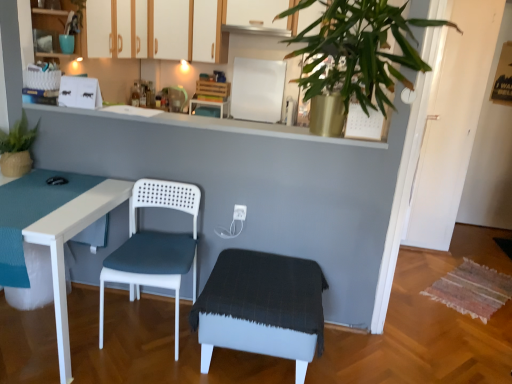
Find the location of `free area in between white plastic chair at center and white fabric step stool at center`. free area in between white plastic chair at center and white fabric step stool at center is located at coordinates (157, 364).